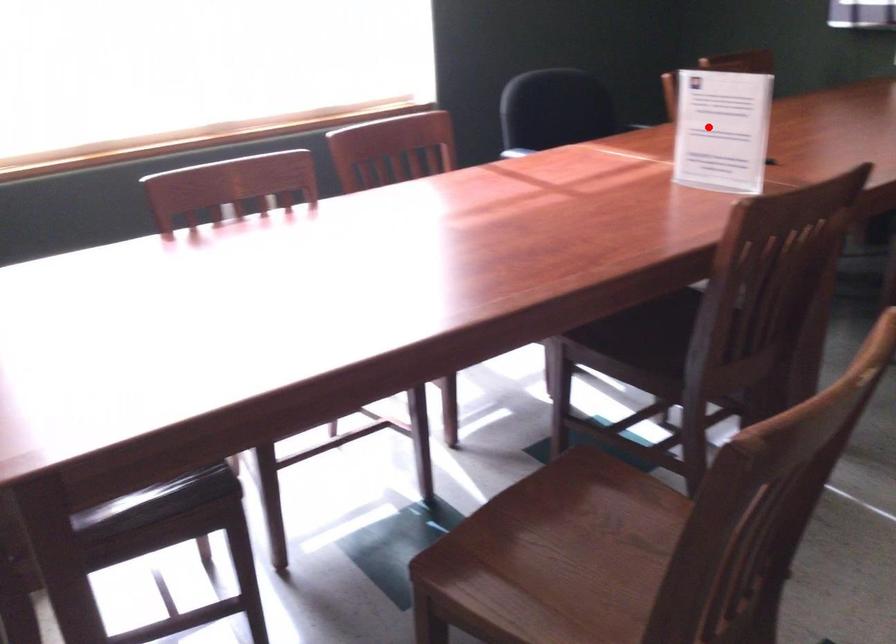
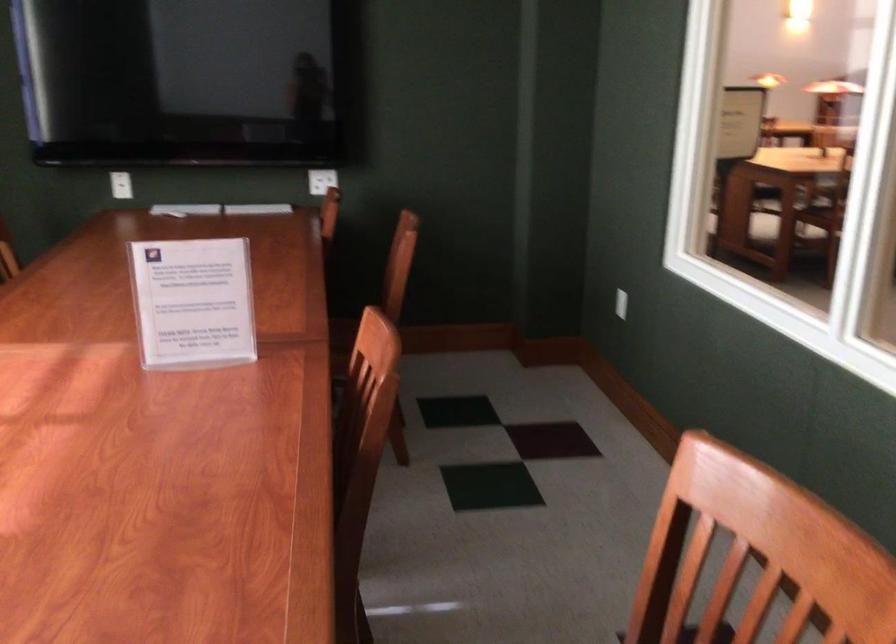
Where in the second image is the point corresponding to the highlighted location from the first image?

(193, 303)